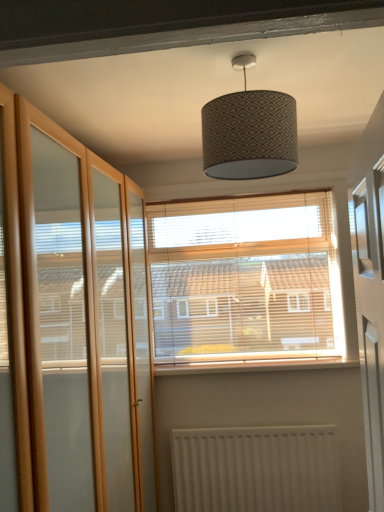
Question: Can you confirm if white textured radiator at lower center is positioned to the right of patterned fabric lampshade at center?

Choices:
 (A) yes
 (B) no

Answer: (A)

Question: Does white textured radiator at lower center have a lesser width compared to patterned fabric lampshade at center?

Choices:
 (A) yes
 (B) no

Answer: (A)

Question: Considering the relative positions of white textured radiator at lower center and patterned fabric lampshade at center in the image provided, is white textured radiator at lower center behind patterned fabric lampshade at center?

Choices:
 (A) yes
 (B) no

Answer: (A)

Question: Is patterned fabric lampshade at center inside white textured radiator at lower center?

Choices:
 (A) yes
 (B) no

Answer: (B)

Question: Considering the relative sizes of white textured radiator at lower center and patterned fabric lampshade at center in the image provided, is white textured radiator at lower center bigger than patterned fabric lampshade at center?

Choices:
 (A) no
 (B) yes

Answer: (B)

Question: From a real-world perspective, is white textured radiator at lower center over patterned fabric lampshade at center?

Choices:
 (A) yes
 (B) no

Answer: (B)

Question: Is the depth of patterned fabric lampshade at center less than that of wooden blinds at center?

Choices:
 (A) yes
 (B) no

Answer: (A)

Question: From a real-world perspective, is patterned fabric lampshade at center physically above wooden blinds at center?

Choices:
 (A) no
 (B) yes

Answer: (B)

Question: Is patterned fabric lampshade at center wider than wooden blinds at center?

Choices:
 (A) no
 (B) yes

Answer: (B)

Question: Does patterned fabric lampshade at center have a greater height compared to wooden blinds at center?

Choices:
 (A) yes
 (B) no

Answer: (B)

Question: Is patterned fabric lampshade at center far from wooden blinds at center?

Choices:
 (A) no
 (B) yes

Answer: (B)

Question: Is wooden blinds at center at the back of patterned fabric lampshade at center?

Choices:
 (A) yes
 (B) no

Answer: (A)

Question: Is white textured radiator at lower center positioned before clear glass screen door at left?

Choices:
 (A) yes
 (B) no

Answer: (B)